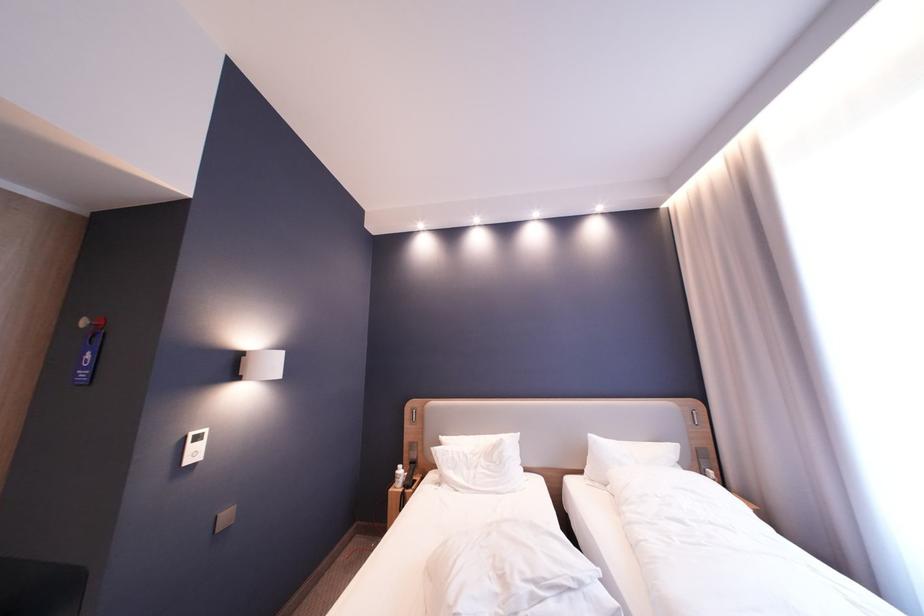
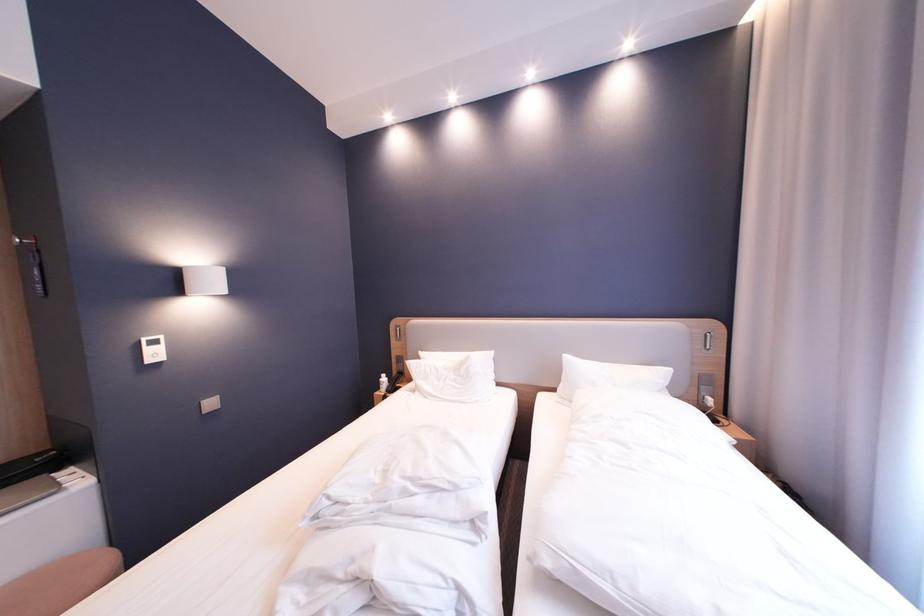
The point at (711, 461) is marked in the first image. Where is the corresponding point in the second image?

(713, 387)